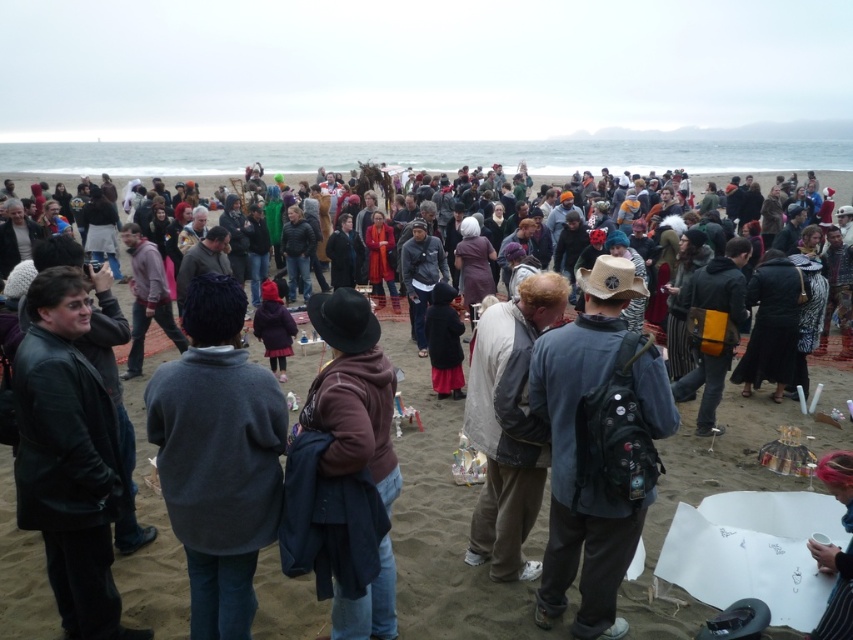
Question: Is the position of matte black jacket at center less distant than that of denim jacket at center?

Choices:
 (A) no
 (B) yes

Answer: (A)

Question: Can you confirm if dark brown leather jacket at center is positioned below denim jacket at center?

Choices:
 (A) no
 (B) yes

Answer: (B)

Question: Which object is positioned farthest from the leather jacket at left?

Choices:
 (A) light beige fabric at center
 (B) dark brown leather jacket at center
 (C) matte black jacket at center

Answer: (C)

Question: Is dark gray sweater at center positioned in front of smooth white cup at lower right?

Choices:
 (A) yes
 (B) no

Answer: (A)

Question: Which point is closer to the camera?

Choices:
 (A) dark brown leather jacket at center
 (B) dark gray sweater at center
 (C) denim jacket at center
 (D) matte black jacket at center

Answer: (B)

Question: Based on their relative distances, which object is nearer to the smooth white cup at lower right?

Choices:
 (A) denim jacket at center
 (B) dark brown leather jacket at center
 (C) dark gray sweater at center

Answer: (A)